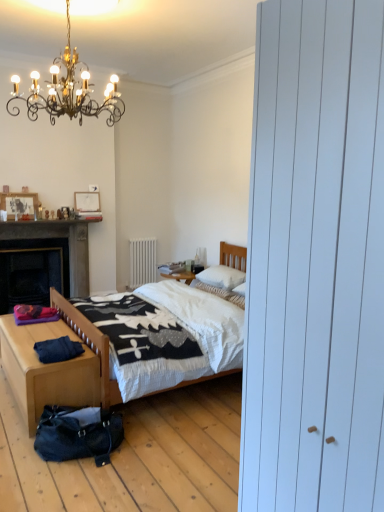
Where is `vacant space underneath wooden picture frame at upper left, which appears as the first picture frame when viewed from the left (from a real-world perspective)`? vacant space underneath wooden picture frame at upper left, which appears as the first picture frame when viewed from the left (from a real-world perspective) is located at coordinates (20, 220).